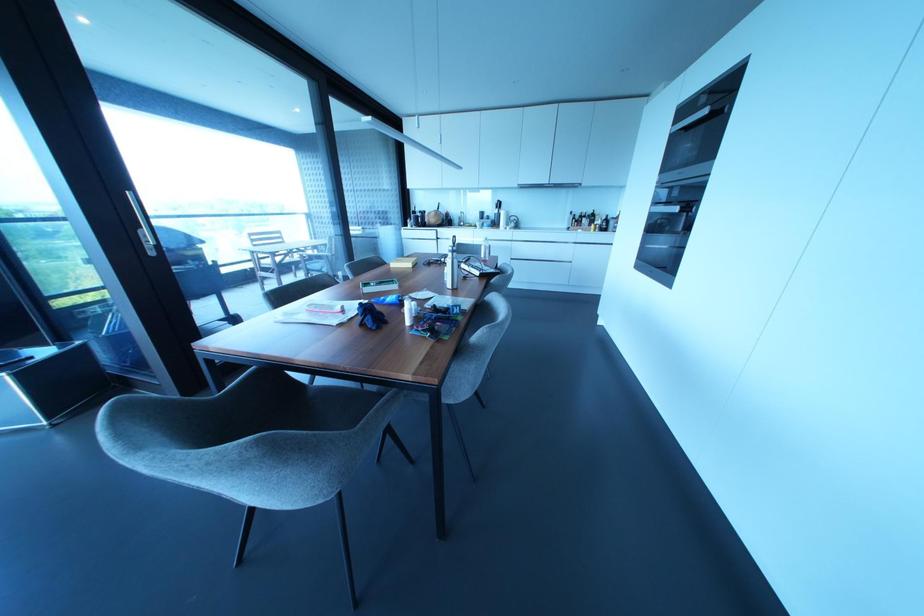
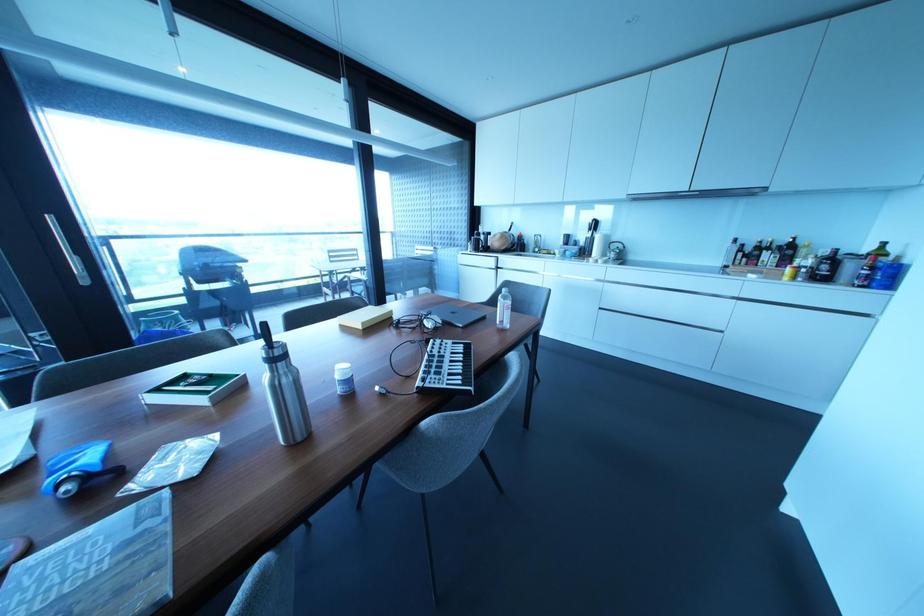
What movement of the cameraman would produce the second image?

The movement direction of the cameraman is right, forward.